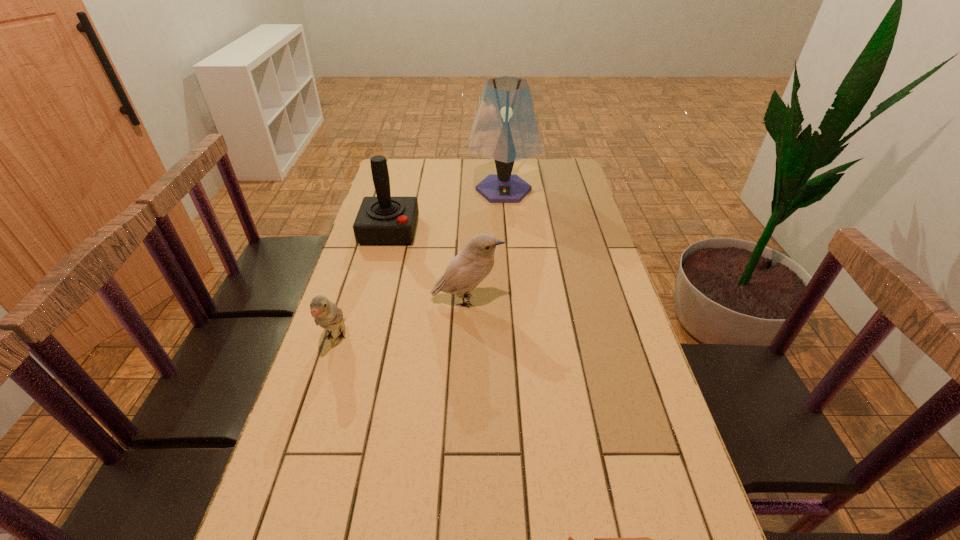
Locate an element on the screen. The height and width of the screenshot is (540, 960). free point between the farthest bird and the second shortest bird is located at coordinates (401, 319).

At what (x,y) coordinates should I click in order to perform the action: click on the fourth closest object relative to the farthest object. Please return your answer as a coordinate pair (x, y). Looking at the image, I should click on (642, 539).

Where is `object that is the third closest to the nearest object`? The width and height of the screenshot is (960, 540). object that is the third closest to the nearest object is located at coordinates (383, 220).

Identify which bird is the second closest to the nearest bird. Please provide its 2D coordinates. Your answer should be formatted as a tuple, i.e. [(x, y)], where the tuple contains the x and y coordinates of a point satisfying the conditions above.

[(326, 314)]

The width and height of the screenshot is (960, 540). In order to click on bird that is the second closest to the tallest object in this screenshot , I will do `click(326, 314)`.

Where is `free space that satisfies the following two spatial constraints: 1. on the base of the tallest object; 2. at the beak of the third nearest object`? The height and width of the screenshot is (540, 960). free space that satisfies the following two spatial constraints: 1. on the base of the tallest object; 2. at the beak of the third nearest object is located at coordinates (513, 300).

Find the location of a particular element. free region that satisfies the following two spatial constraints: 1. on the base of the lampshade; 2. at the beak of the farthest bird is located at coordinates (513, 300).